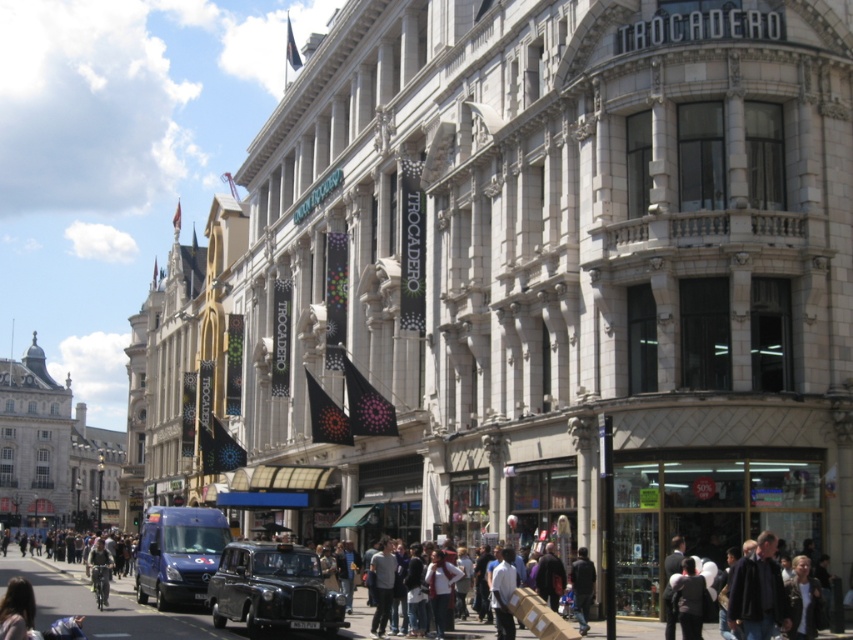
Looking at this image, you are a delivery person who needs to park your black matte taxi at center in a specific spot. The parking spot is at coordinates 0.920, 0.320. Is your current position correct?

Yes, the black matte taxi at center is already positioned at coordinates (271,588), so it is correctly parked.